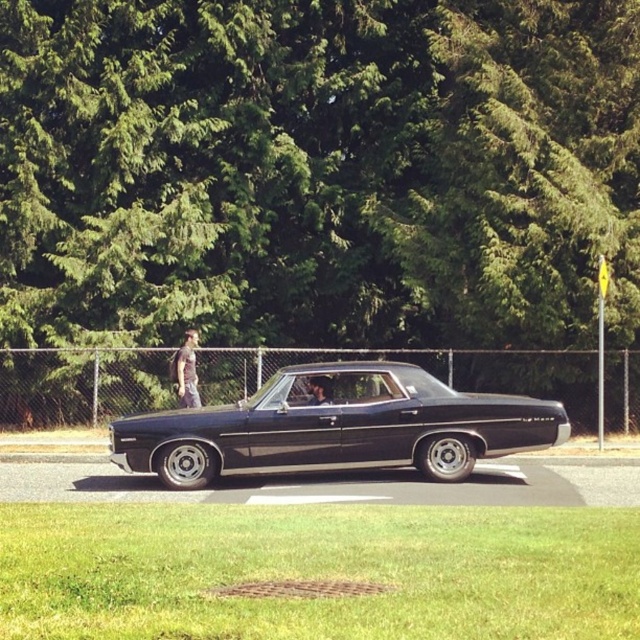
Consider the image. Can you confirm if shiny black car at center is positioned to the right of gray fabric jacket at left?

Correct, you'll find shiny black car at center to the right of gray fabric jacket at left.

Can you confirm if shiny black car at center is positioned below gray fabric jacket at left?

Yes.

Measure the distance between shiny black car at center and camera.

shiny black car at center is 49.71 feet away from camera.

You are a GUI agent. You are given a task and a screenshot of the screen. Output one action in this format:
    pyautogui.click(x=<x>, y=<y>)
    Task: Click on the shiny black car at center
    This screenshot has width=640, height=640.
    Given the screenshot: What is the action you would take?
    pyautogui.click(x=337, y=426)